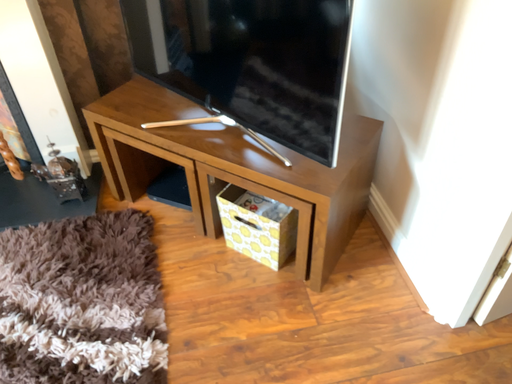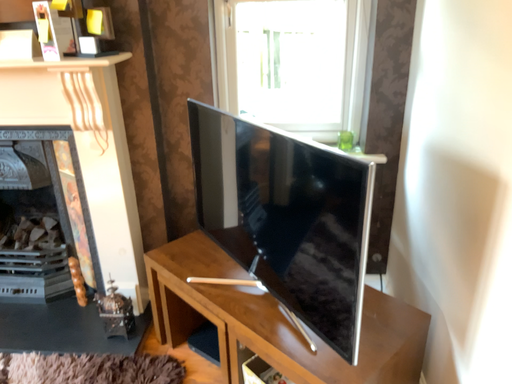
Question: How did the camera likely rotate when shooting the video?

Choices:
 (A) rotated upward
 (B) rotated downward

Answer: (A)